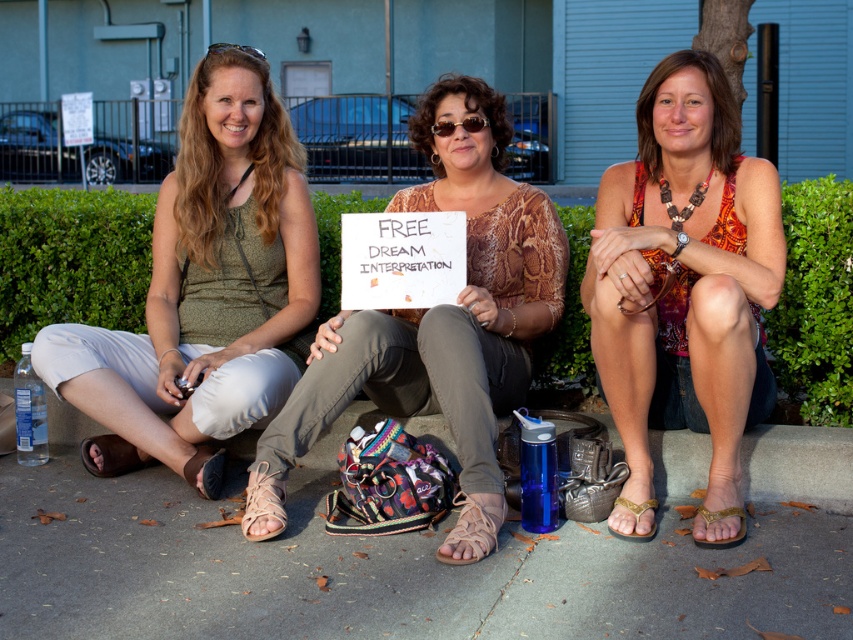
You are a person who wants to sit down on the gray concrete pavement at lower center. Can you sit directly under the brown snakeskin shirt at center without moving either object?

The gray concrete pavement at lower center is below the brown snakeskin shirt at center, so yes, you can sit directly under it since the pavement is positioned beneath the shirt.

You are a photographer trying to capture both the brown leather sandal at center and the tan leather sandal at lower left in a single shot. Which sandal should you focus on first to ensure both are in clear view?

The brown leather sandal at center is closer to the viewer than the tan leather sandal at lower left, so focusing on the brown leather sandal at center first will help ensure both are in clear view.